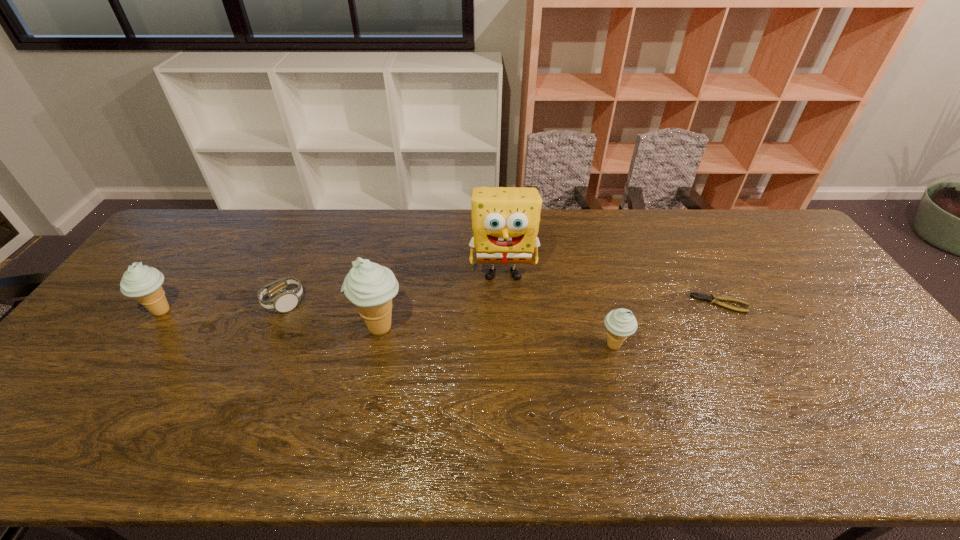
I want to click on free space that satisfies the following two spatial constraints: 1. on the face of the shortest object; 2. on the right side of the fourth object from left to right, so 505,303.

In order to click on free location that satisfies the following two spatial constraints: 1. on the face of the sponge; 2. on the face of the watch in this screenshot , I will do `click(505, 302)`.

I want to click on blank area in the image that satisfies the following two spatial constraints: 1. on the back side of the pliers; 2. on the left side of the second shortest icecream, so click(168, 303).

Identify the location of blank area in the image that satisfies the following two spatial constraints: 1. on the face of the watch; 2. on the right side of the fifth object from left to right. (265, 346).